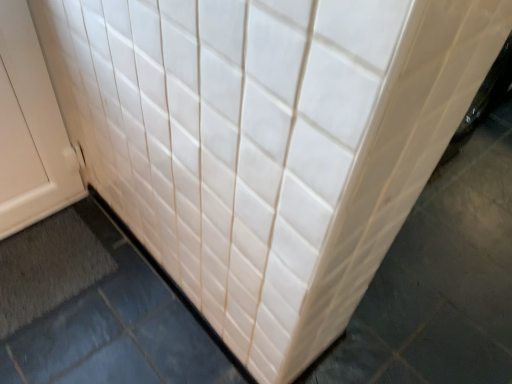
Measure the distance between gray textured bath mat at lower left and camera.

gray textured bath mat at lower left and camera are 4.26 feet apart.

This screenshot has height=384, width=512. What do you see at coordinates (48, 268) in the screenshot?
I see `gray textured bath mat at lower left` at bounding box center [48, 268].

In order to click on gray textured bath mat at lower left in this screenshot , I will do `click(48, 268)`.

At what (x,y) coordinates should I click in order to perform the action: click on gray textured bath mat at lower left. Please return your answer as a coordinate pair (x, y). Looking at the image, I should click on (48, 268).